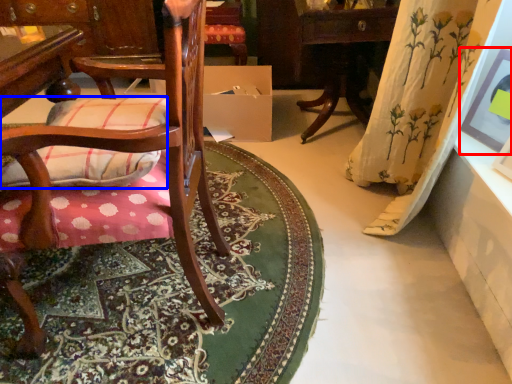
Question: Which of the following is the farthest to the observer, picture frame (highlighted by a red box) or throw pillow (highlighted by a blue box)?

Choices:
 (A) picture frame
 (B) throw pillow

Answer: (A)